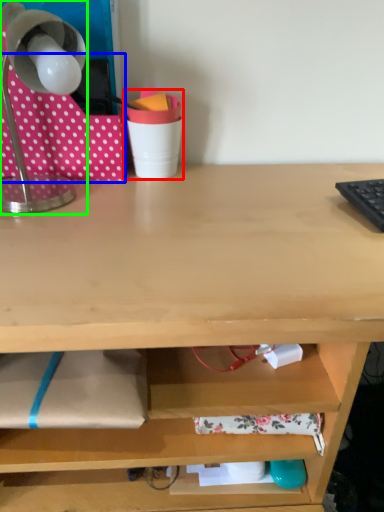
Question: Based on their relative distances, which object is nearer to stationery (highlighted by a red box)? Choose from fabric (highlighted by a blue box) and lamp (highlighted by a green box).

Choices:
 (A) fabric
 (B) lamp

Answer: (A)